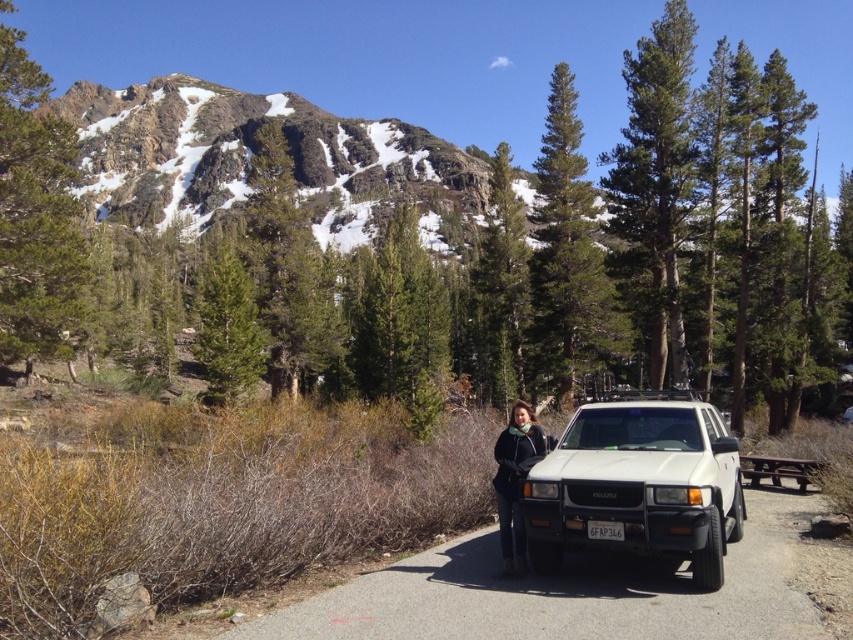
Question: Does dark blue jacket at center come in front of white plastic license plate at center?

Choices:
 (A) yes
 (B) no

Answer: (B)

Question: Which point is closer to the camera?

Choices:
 (A) dark blue jacket at center
 (B) white plastic license plate at center
 (C) white matte jeep at center

Answer: (C)

Question: Which of the following is the closest to the observer?

Choices:
 (A) (683, 493)
 (B) (502, 502)

Answer: (A)

Question: Which object is farther from the camera taking this photo?

Choices:
 (A) white plastic license plate at center
 (B) white matte jeep at center
 (C) dark blue jacket at center

Answer: (C)

Question: Is the position of white matte jeep at center more distant than that of white plastic license plate at center?

Choices:
 (A) yes
 (B) no

Answer: (B)

Question: Is white matte jeep at center smaller than white plastic license plate at center?

Choices:
 (A) no
 (B) yes

Answer: (A)